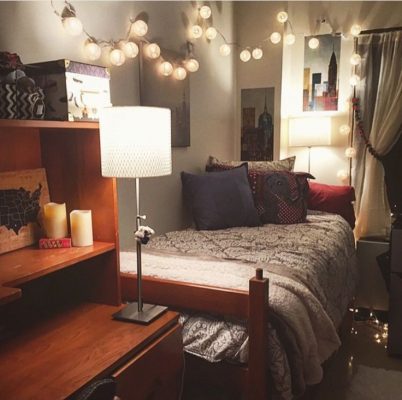
Image resolution: width=402 pixels, height=400 pixels. I want to click on shelves, so click(41, 264).